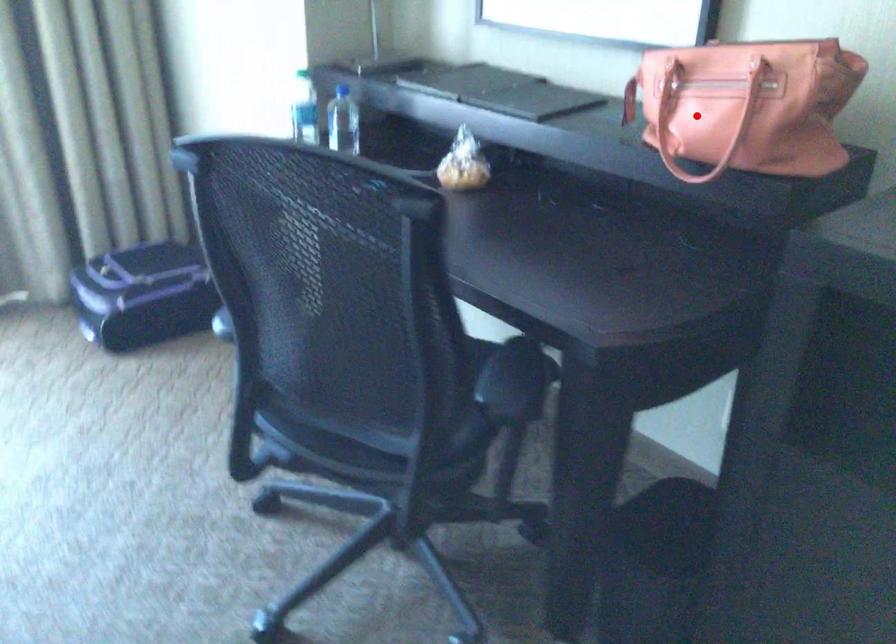
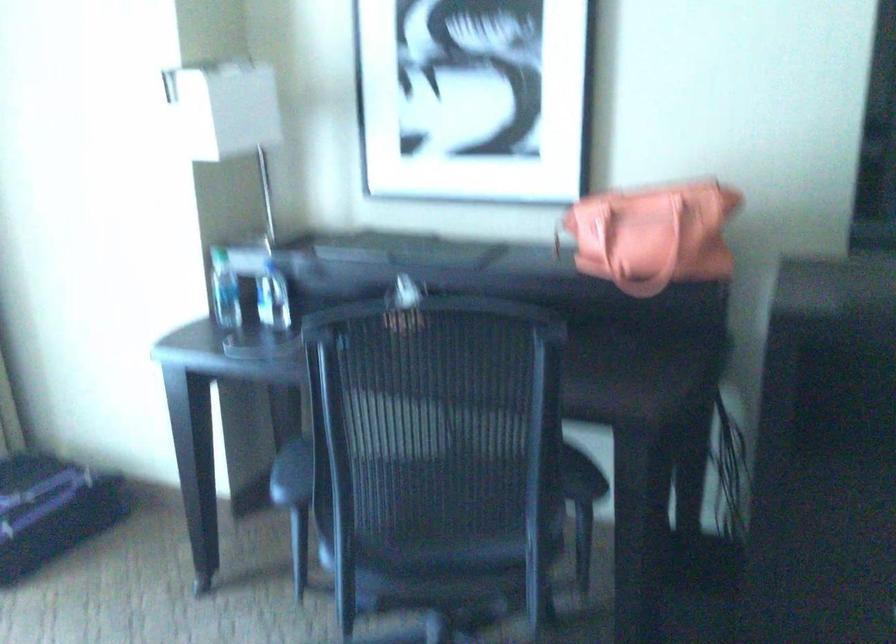
Question: I am providing you with two images of the same scene from different viewpoints. In image1, a red point is highlighted. Considering the same 3D point in image2, which of the following is correct?

Choices:
 (A) It is closer
 (B) It is farther

Answer: (B)